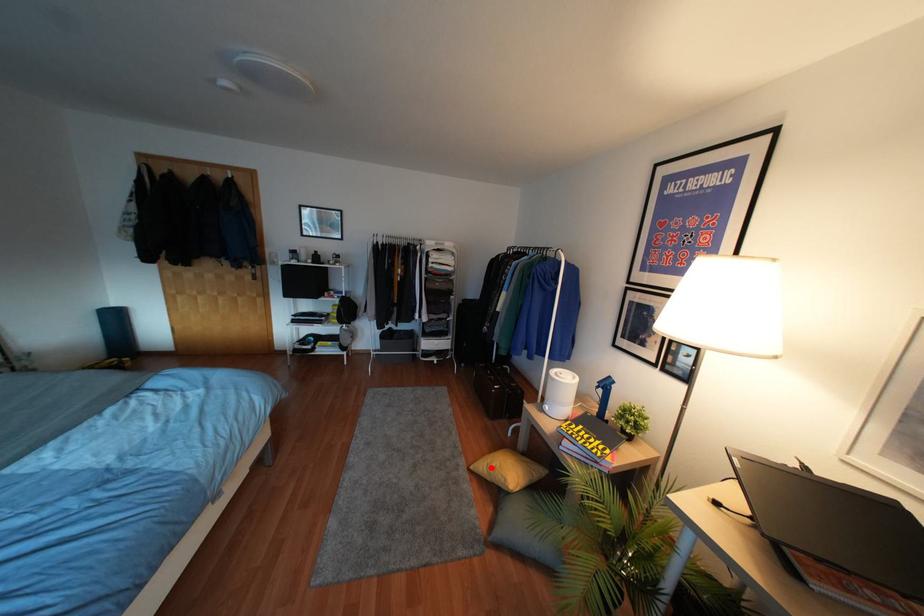
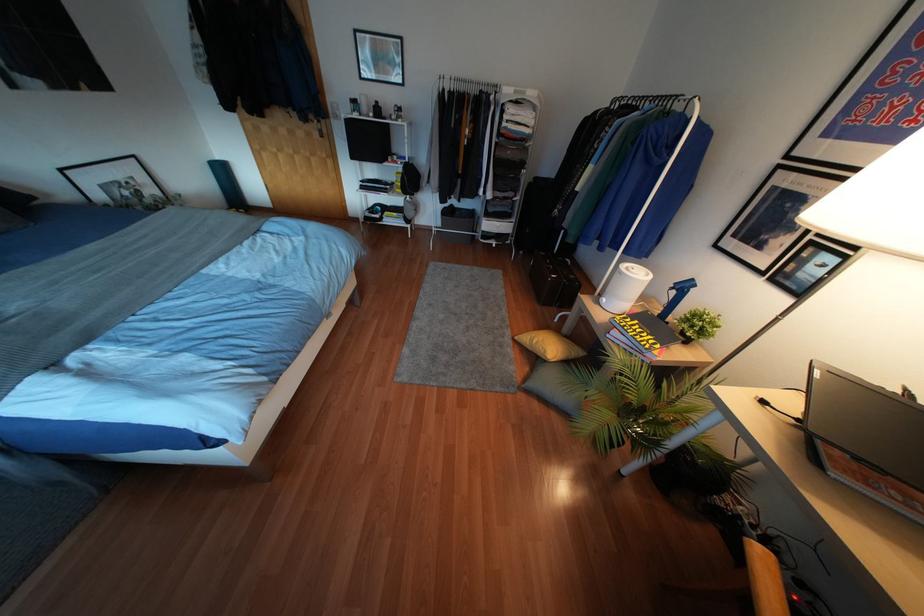
Question: I am providing you with two images of the same scene from different viewpoints. Given a red point in image1, look at the same physical point in image2. Is it:

Choices:
 (A) Closer to the viewpoint
 (B) Farther from the viewpoint

Answer: (B)